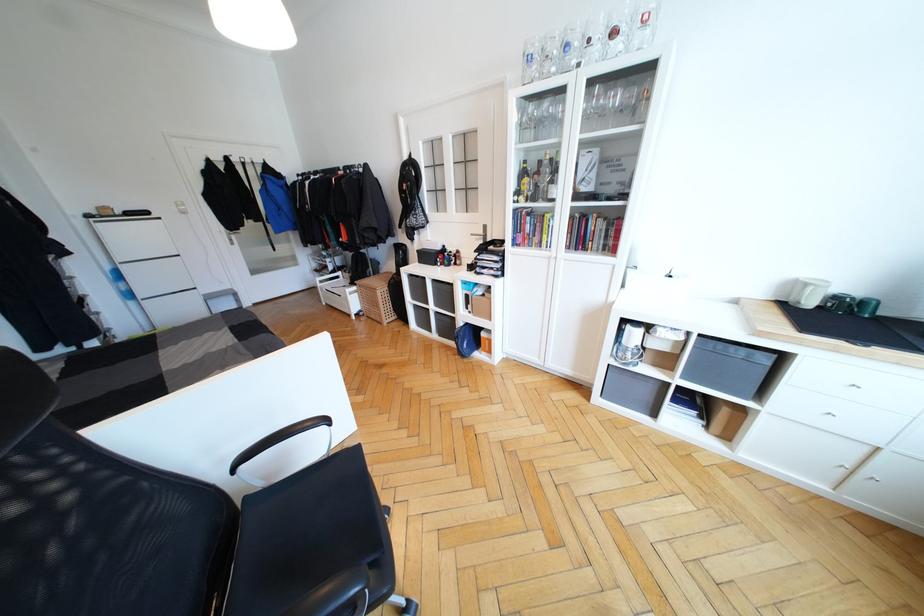
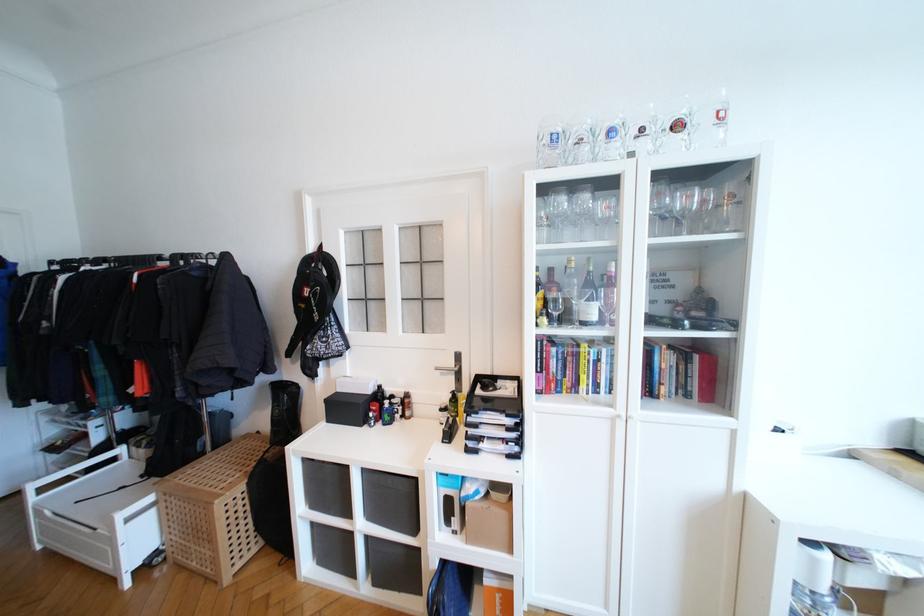
In the second image, find the point that corresponds to (483,299) in the first image.

(489, 506)